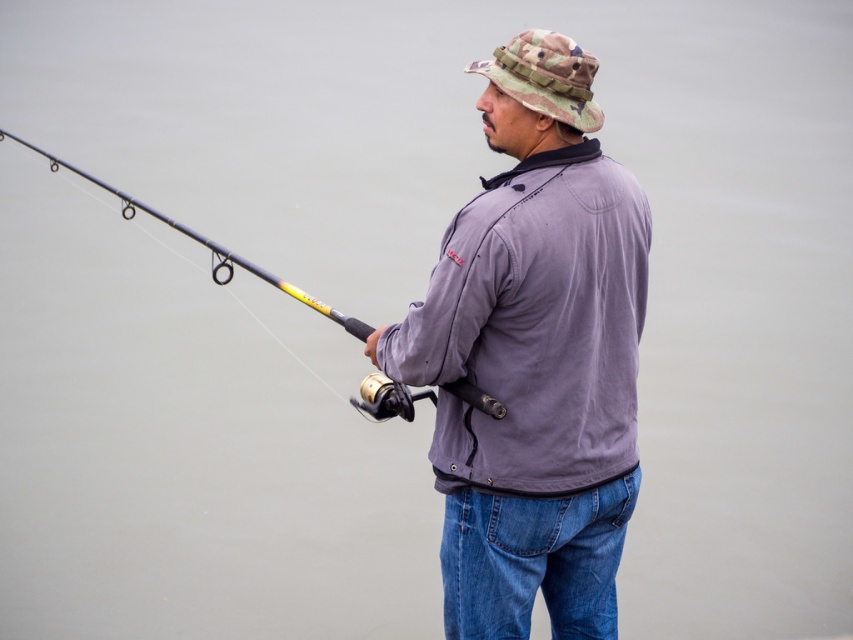
Question: Observing the image, what is the correct spatial positioning of purple matte jacket at center in reference to yellow and black fishing rod at left?

Choices:
 (A) below
 (B) above

Answer: (A)

Question: Which of these objects is positioned farthest from the camo fabric hat at upper center?

Choices:
 (A) yellow and black fishing rod at left
 (B) purple matte jacket at center

Answer: (A)

Question: Is purple matte jacket at center positioned behind yellow and black fishing rod at left?

Choices:
 (A) yes
 (B) no

Answer: (B)

Question: Estimate the real-world distances between objects in this image. Which object is closer to the camo fabric hat at upper center?

Choices:
 (A) purple matte jacket at center
 (B) yellow and black fishing rod at left

Answer: (A)

Question: Where is camo fabric hat at upper center located in relation to yellow and black fishing rod at left in the image?

Choices:
 (A) left
 (B) right

Answer: (B)

Question: Which of the following is the farthest from the observer?

Choices:
 (A) camo fabric hat at upper center
 (B) purple matte jacket at center
 (C) yellow and black fishing rod at left

Answer: (C)